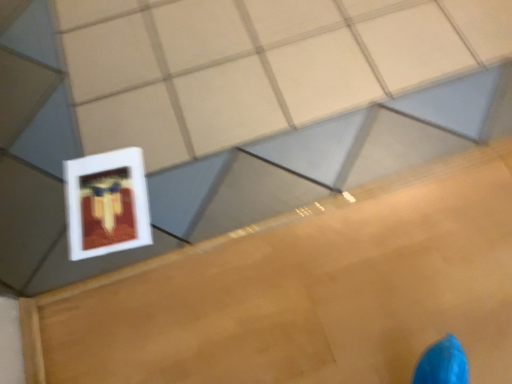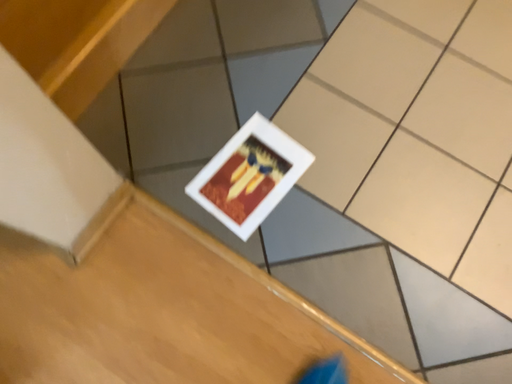
Question: Which way did the camera rotate in the video?

Choices:
 (A) rotated left
 (B) rotated right

Answer: (A)